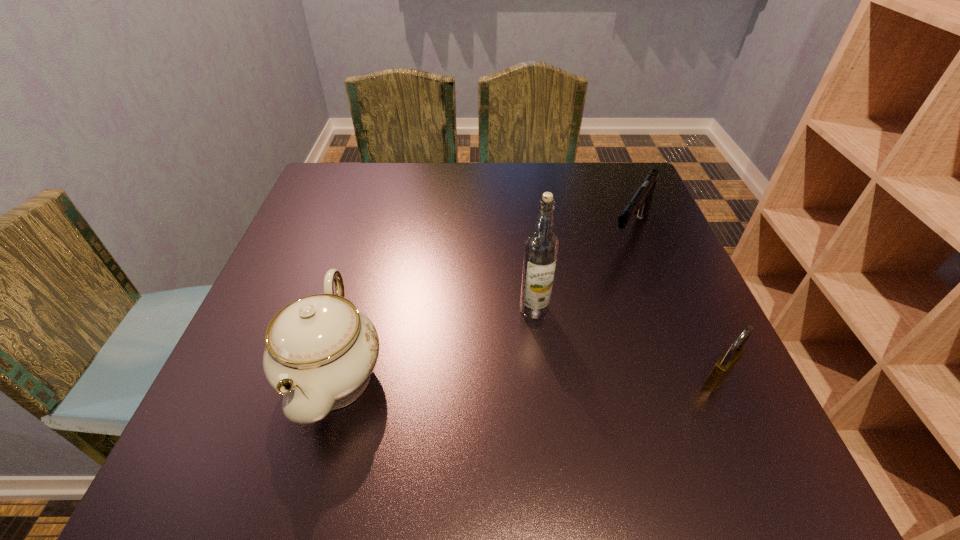
Where is `the leftmost object`? This screenshot has width=960, height=540. the leftmost object is located at coordinates (320, 352).

The image size is (960, 540). I want to click on the third shortest object, so click(320, 352).

This screenshot has height=540, width=960. What are the coordinates of `padlock` in the screenshot? It's located at (727, 361).

You are a GUI agent. You are given a task and a screenshot of the screen. Output one action in this format:
    pyautogui.click(x=<x>, y=<y>)
    Task: Click on the gun
    The height and width of the screenshot is (540, 960).
    Given the screenshot: What is the action you would take?
    [x=640, y=203]

Find the location of a particular element. the second object from left to right is located at coordinates (541, 246).

Image resolution: width=960 pixels, height=540 pixels. I want to click on vodka, so click(x=541, y=246).

At what (x,y) coordinates should I click in order to perform the action: click on vacant area located 0.270m on the back of the padlock. Please return your answer as a coordinate pair (x, y). Looking at the image, I should click on (665, 265).

Where is `vacant space located 0.330m at the aiming end of the farthest object`? The height and width of the screenshot is (540, 960). vacant space located 0.330m at the aiming end of the farthest object is located at coordinates [560, 358].

This screenshot has width=960, height=540. I want to click on vacant space located at the aiming end of the farthest object, so coord(573,336).

Where is `free region located at the aiming end of the farthest object`? The height and width of the screenshot is (540, 960). free region located at the aiming end of the farthest object is located at coordinates (614, 270).